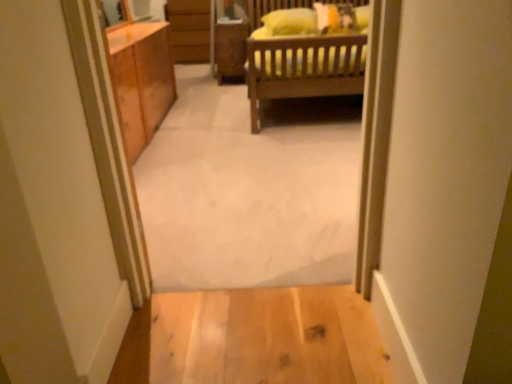
Question: From a real-world perspective, is light wood floor at lower center, the 2th plain viewed from the top, positioned above or below carpet at center, the first plain positioned from the top?

Choices:
 (A) above
 (B) below

Answer: (B)

Question: From the image's perspective, is light wood floor at lower center, arranged as the 1th plain when ordered from the bottom, positioned above or below carpet at center, the first plain positioned from the top?

Choices:
 (A) above
 (B) below

Answer: (B)

Question: Which of these objects is positioned farthest from the carpet at center, which is the second plain from bottom to top?

Choices:
 (A) wooden cabinet at center
 (B) yellow soft pillow at upper center
 (C) light wood floor at lower center, the 2th plain viewed from the top

Answer: (A)

Question: Which of these objects is positioned farthest from the light wood floor at lower center, the 2th plain viewed from the top?

Choices:
 (A) carpet at center, which is the second plain from bottom to top
 (B) yellow soft pillow at upper center
 (C) wooden cabinet at center

Answer: (C)